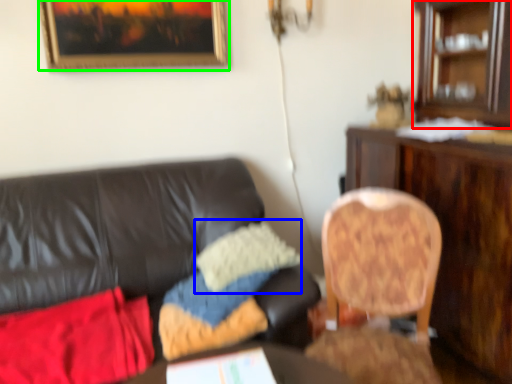
Question: Which is nearer to the cabinetry (highlighted by a red box)? pillow (highlighted by a blue box) or picture frame (highlighted by a green box).

Choices:
 (A) pillow
 (B) picture frame

Answer: (A)